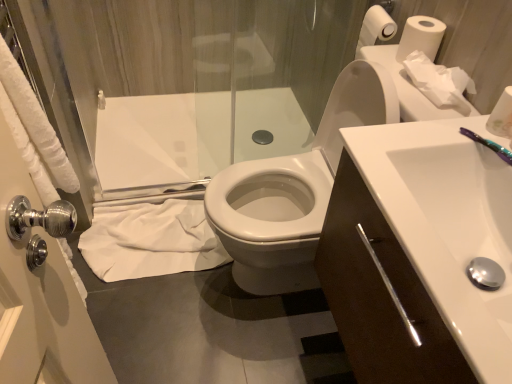
Find the location of a particular element. This screenshot has width=512, height=384. white matte toilet paper at upper right, the 4th toilet paper positioned from the back is located at coordinates (501, 115).

Measure the distance between white matte toilet paper at upper right, acting as the first toilet paper starting from the bottom, and camera.

A distance of 32.99 inches exists between white matte toilet paper at upper right, acting as the first toilet paper starting from the bottom, and camera.

Find the location of a particular element. white matte toilet paper at upper right, which is counted as the 3th toilet paper, starting from the bottom is located at coordinates (420, 37).

What do you see at coordinates (183, 82) in the screenshot? I see `transparent glass shower door at upper left` at bounding box center [183, 82].

What do you see at coordinates (448, 223) in the screenshot? I see `white glossy sink at center right` at bounding box center [448, 223].

Measure the distance between purple plastic toothbrush at upper right and camera.

The distance of purple plastic toothbrush at upper right from camera is 32.97 inches.

The height and width of the screenshot is (384, 512). I want to click on white matte toilet paper at upper right, positioned as the 4th toilet paper in top-to-bottom order, so click(x=501, y=115).

In the scene shown: Is purple plastic toothbrush at upper right facing away from white matte toilet paper at upper right, which is the 2th toilet paper in top-to-bottom order?

purple plastic toothbrush at upper right is not turned away from white matte toilet paper at upper right, which is the 2th toilet paper in top-to-bottom order.

Which object is positioned more to the right, purple plastic toothbrush at upper right or white matte toilet paper at upper right, which is the 2th toilet paper in top-to-bottom order?

Positioned to the right is purple plastic toothbrush at upper right.

From a real-world perspective, is purple plastic toothbrush at upper right below white matte toilet paper at upper right, which is counted as the 3th toilet paper, starting from the bottom?

Indeed, from a real-world perspective, purple plastic toothbrush at upper right is positioned beneath white matte toilet paper at upper right, which is counted as the 3th toilet paper, starting from the bottom.

Based on the photo, is the depth of purple plastic toothbrush at upper right less than that of white matte toilet paper at upper right, the third toilet paper positioned from the front?

That is True.

Can you confirm if white glossy sink at center right is bigger than transparent glass shower door at upper left?

Incorrect, white glossy sink at center right is not larger than transparent glass shower door at upper left.

Does point (454, 169) come in front of point (154, 124)?

Yes, it is.

Is white glossy sink at center right looking in the opposite direction of transparent glass shower door at upper left?

No, white glossy sink at center right is not facing the opposite direction of transparent glass shower door at upper left.

Is white glossy sink at center right far away from transparent glass shower door at upper left?

white glossy sink at center right is positioned a significant distance from transparent glass shower door at upper left.

From a real-world perspective, is white glossy toilet at center physically located above or below silver metallic screen door at left?

white glossy toilet at center is situated lower than silver metallic screen door at left in the real world.

Does white glossy toilet at center have a larger size compared to silver metallic screen door at left?

Yes.

Considering the relative sizes of white glossy toilet at center and silver metallic screen door at left in the image provided, is white glossy toilet at center taller than silver metallic screen door at left?

Yes, white glossy toilet at center is taller than silver metallic screen door at left.

From the image's perspective, is white glossy toilet at center located above or below silver metallic screen door at left?

From the image's perspective, white glossy toilet at center appears below silver metallic screen door at left.

Is white paper tissue at upper right, which appears as the 2th toilet paper when ordered from the bottom, located outside white matte toilet paper at upper right, positioned as the 4th toilet paper in top-to-bottom order?

white paper tissue at upper right, which appears as the 2th toilet paper when ordered from the bottom, is positioned outside white matte toilet paper at upper right, positioned as the 4th toilet paper in top-to-bottom order.

Which is in front, point (416, 50) or point (506, 106)?

The point (506, 106) is closer.

Is white paper tissue at upper right, the second toilet paper positioned from the front, wider than white matte toilet paper at upper right, acting as the first toilet paper starting from the bottom?

Correct, the width of white paper tissue at upper right, the second toilet paper positioned from the front, exceeds that of white matte toilet paper at upper right, acting as the first toilet paper starting from the bottom.

Considering the sizes of white paper tissue at upper right, the second toilet paper positioned from the front, and white matte toilet paper at upper right, acting as the first toilet paper starting from the bottom, in the image, is white paper tissue at upper right, the second toilet paper positioned from the front, bigger or smaller than white matte toilet paper at upper right, acting as the first toilet paper starting from the bottom,?

Considering their sizes, white paper tissue at upper right, the second toilet paper positioned from the front, takes up more space than white matte toilet paper at upper right, acting as the first toilet paper starting from the bottom.

Which is less distant, (425, 34) or (449, 101)?

Positioned in front is point (449, 101).

From the image's perspective, which toilet paper is the 1st one below the white matte toilet paper at upper right, which ranks as the 2th toilet paper in back-to-front order? Please provide its 2D coordinates.

[(439, 82)]

Can white paper tissue at upper right, the second toilet paper positioned from the front, be found inside white matte toilet paper at upper right, which is counted as the 3th toilet paper, starting from the bottom?

No, white paper tissue at upper right, the second toilet paper positioned from the front, is located outside of white matte toilet paper at upper right, which is counted as the 3th toilet paper, starting from the bottom.

From the image's perspective, who appears lower, silver metallic screen door at left or white cloth at lower left?

white cloth at lower left, from the image's perspective.

Is silver metallic screen door at left in front of or behind white cloth at lower left in the image?

Clearly, silver metallic screen door at left is in front of white cloth at lower left.

Can you confirm if silver metallic screen door at left is positioned to the left of white cloth at lower left?

Yes.

Considering the positions of points (22, 141) and (150, 265), is point (22, 141) closer to camera compared to point (150, 265)?

That is True.

The image size is (512, 384). What are the coordinates of `toothbrush in front of the white matte toilet paper at upper right, arranged as the first toilet paper when viewed from the front` in the screenshot? It's located at (489, 145).

Which object is closer to the camera taking this photo, purple plastic toothbrush at upper right or white matte toilet paper at upper right, acting as the first toilet paper starting from the bottom?

purple plastic toothbrush at upper right is more forward.

Which object is wider, purple plastic toothbrush at upper right or white matte toilet paper at upper right, acting as the first toilet paper starting from the bottom?

white matte toilet paper at upper right, acting as the first toilet paper starting from the bottom, is wider.

The width and height of the screenshot is (512, 384). Find the location of `toothbrush in front of the white matte toilet paper at upper right, which ranks as the 2th toilet paper in back-to-front order`. toothbrush in front of the white matte toilet paper at upper right, which ranks as the 2th toilet paper in back-to-front order is located at coordinates (489, 145).

The image size is (512, 384). In order to click on sink located above the transparent glass shower door at upper left (from a real-world perspective) in this screenshot , I will do `click(448, 223)`.

From the image, which object appears to be nearer to transparent glass shower door at upper left, purple plastic toothbrush at upper right or white glossy sink at center right?

The object closer to transparent glass shower door at upper left is white glossy sink at center right.

Considering their positions, is white glossy toilet at center positioned further to silver metallic screen door at left than white matte toilet paper at upper right, which is counted as the 3th toilet paper, starting from the bottom?

The object further to silver metallic screen door at left is white matte toilet paper at upper right, which is counted as the 3th toilet paper, starting from the bottom.

From the image, which object appears to be nearer to white matte toilet paper at upper right, the 4th toilet paper positioned from the back, white cloth at lower left or white glossy toilet at center?

white glossy toilet at center lies closer to white matte toilet paper at upper right, the 4th toilet paper positioned from the back, than the other object.

Looking at the image, which one is located closer to white matte toilet paper at upper right, arranged as the first toilet paper when viewed from the front, white glossy sink at center right or white glossy toilet at center?

Among the two, white glossy sink at center right is located nearer to white matte toilet paper at upper right, arranged as the first toilet paper when viewed from the front.

Considering their positions, is white matte toilet paper at upper right, the third toilet paper positioned from the front, positioned closer to white paper tissue at upper right, the second toilet paper positioned from the front, than white matte toilet paper at upper right, acting as the first toilet paper starting from the bottom?

white matte toilet paper at upper right, the third toilet paper positioned from the front, is positioned closer to the anchor white paper tissue at upper right, the second toilet paper positioned from the front.

Considering their positions, is purple plastic toothbrush at upper right positioned further to white glossy toilet at center than silver metallic screen door at left?

silver metallic screen door at left lies further to white glossy toilet at center than the other object.

Considering their positions, is white paper roll at upper right, arranged as the first toilet paper when viewed from the top, positioned closer to purple plastic toothbrush at upper right than white matte toilet paper at upper right, which is counted as the 3th toilet paper, starting from the bottom?

The object closer to purple plastic toothbrush at upper right is white matte toilet paper at upper right, which is counted as the 3th toilet paper, starting from the bottom.

From the image, which object appears to be nearer to white paper tissue at upper right, positioned as the 3th toilet paper in back-to-front order, transparent glass shower door at upper left or silver metallic screen door at left?

silver metallic screen door at left lies closer to white paper tissue at upper right, positioned as the 3th toilet paper in back-to-front order, than the other object.

Identify the location of shower door between silver metallic screen door at left and white paper tissue at upper right, which appears as the 2th toilet paper when ordered from the bottom, in the horizontal direction. (183, 82).

Identify the location of toothbrush between white paper roll at upper right, which is the first toilet paper from back to front, and white glossy toilet at center in the up-down direction. (489, 145).

You are a GUI agent. You are given a task and a screenshot of the screen. Output one action in this format:
    pyautogui.click(x=<x>, y=<y>)
    Task: Click on the toilet between white glossy sink at center right and white paper tissue at upper right, the second toilet paper positioned from the front, from front to back
    The image size is (512, 384).
    Given the screenshot: What is the action you would take?
    pyautogui.click(x=293, y=190)

Where is `toilet paper located between silver metallic screen door at left and white matte toilet paper at upper right, which is the 2th toilet paper in top-to-bottom order, in the left-right direction`? toilet paper located between silver metallic screen door at left and white matte toilet paper at upper right, which is the 2th toilet paper in top-to-bottom order, in the left-right direction is located at coordinates (376, 26).